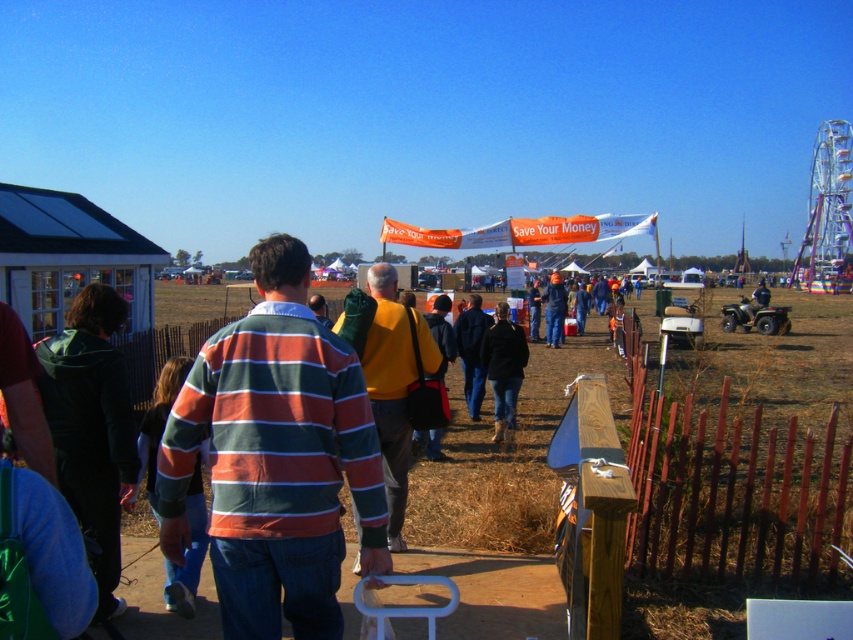
You are at the fair and see two people in the center. One is wearing a striped cotton shirt at center and the other a yellow sweater at center. Which one is positioned more to the left?

The striped cotton shirt at center is positioned to the left of the yellow sweater at center, so the striped cotton shirt at center is more to the left.

Based on the scene description, can you determine if the striped cotton shirt at center is wider than the dark blue jeans at center?

The striped cotton shirt at center is wider than the dark blue jeans at center according to the description.

From the picture: You are standing at the camera position and want to hand a flyer to the person in the yellow sweater at center. Can you reach them without moving from your current position if your longest arm reach is 2 meters?

The yellow sweater at center is 4.55 meters away from the camera, so you cannot reach them with a 2 meter arm reach. You would need to move closer.